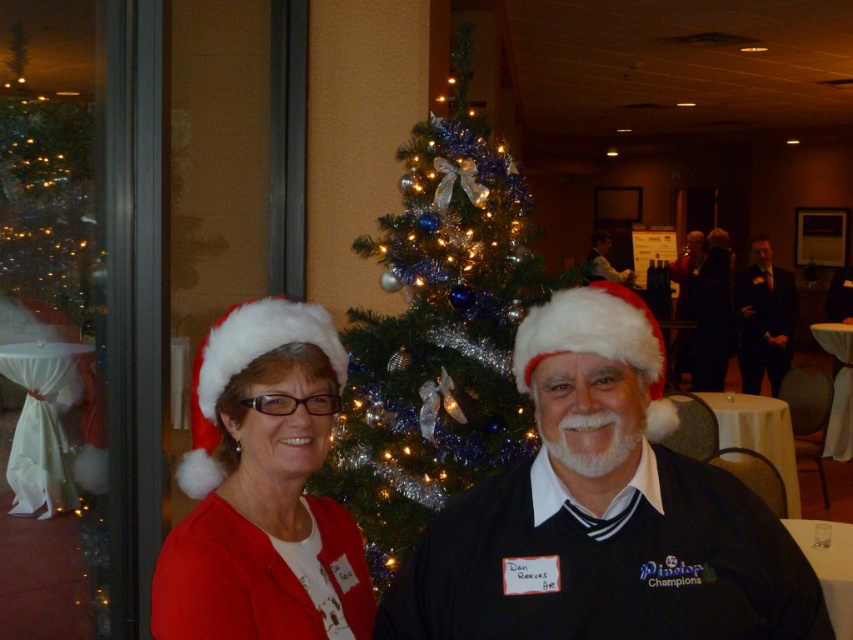
Question: Is the position of white fluffy santa hat at left more distant than that of matte black santa hat at center?

Choices:
 (A) no
 (B) yes

Answer: (A)

Question: Which point is closer to the camera?

Choices:
 (A) (701, 244)
 (B) (657, 522)

Answer: (B)

Question: Is white fluffy santa hat at left positioned before dark suit at center?

Choices:
 (A) no
 (B) yes

Answer: (B)

Question: Which is nearer to the matte black suit at right?

Choices:
 (A) white santa hat at center
 (B) matte red sweater at center
 (C) shiny blue and silver ornaments at center
 (D) matte black santa hat at center

Answer: (D)

Question: Which is farther from the dark suit at center?

Choices:
 (A) matte red sweater at center
 (B) matte black santa hat at center
 (C) shiny blue and silver ornaments at center
 (D) matte black suit at right

Answer: (A)

Question: Is white santa hat at center in front of matte red sweater at center?

Choices:
 (A) yes
 (B) no

Answer: (B)